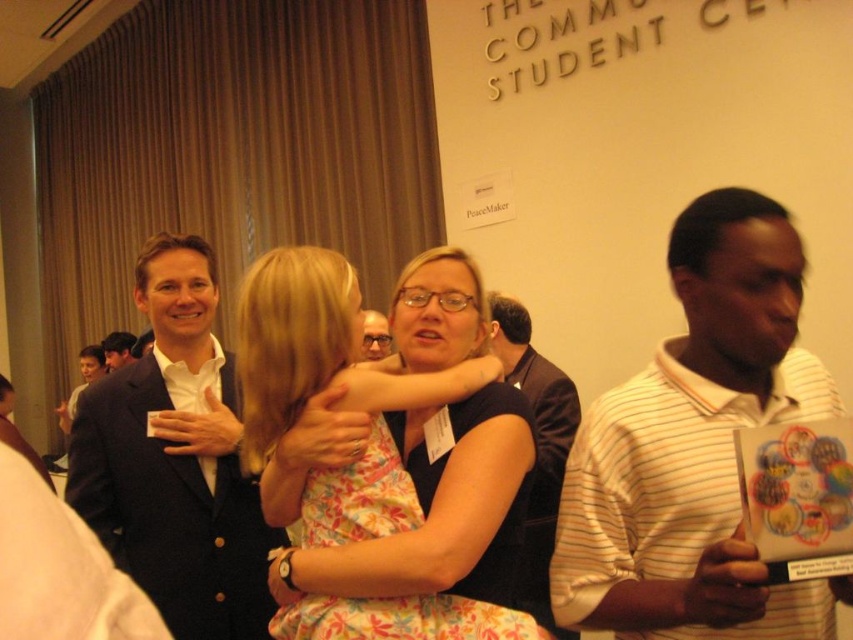
Who is lower down, white striped polo shirt at right or matte black suit at center?

white striped polo shirt at right

Is point (704, 497) positioned in front of point (366, 330)?

Yes, it is in front of point (366, 330).

This screenshot has width=853, height=640. Identify the location of white striped polo shirt at right. (695, 448).

Between white striped polo shirt at right and dark suit at center, which one has less height?

Standing shorter between the two is dark suit at center.

Between white striped polo shirt at right and dark suit at center, which one appears on the left side from the viewer's perspective?

From the viewer's perspective, dark suit at center appears more on the left side.

Measure the distance between white striped polo shirt at right and camera.

white striped polo shirt at right and camera are 37.86 inches apart from each other.

I want to click on white striped polo shirt at right, so click(x=695, y=448).

Is the position of dark blue suit at center more distant than that of dark suit at center?

That is False.

Based on the photo, which is below, dark blue suit at center or dark suit at center?

dark blue suit at center

Find the location of a particular element. dark blue suit at center is located at coordinates (175, 460).